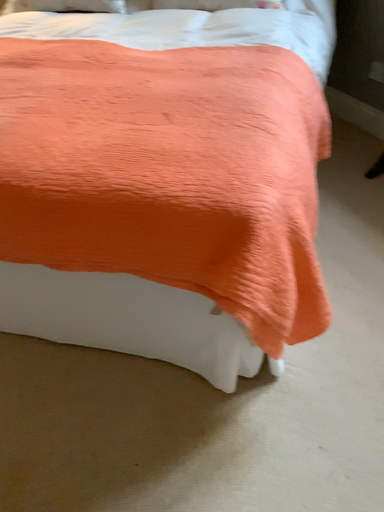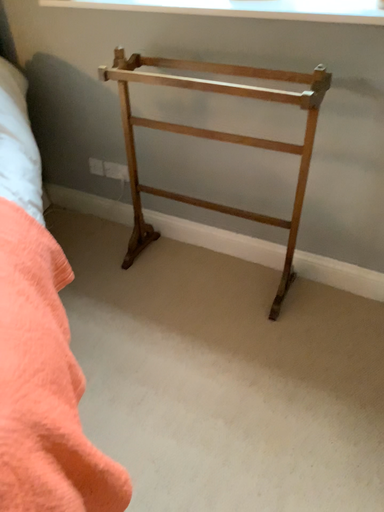
Question: How did the camera likely rotate when shooting the video?

Choices:
 (A) rotated left
 (B) rotated right

Answer: (B)